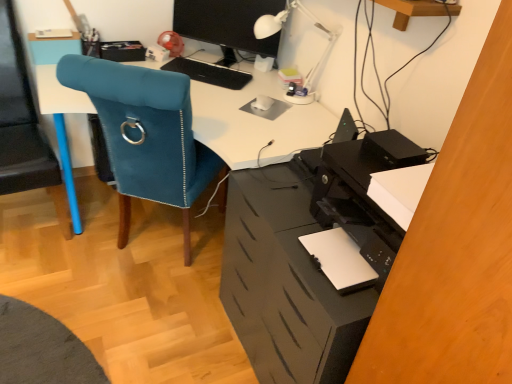
Question: Is black matte file cabinet at lower right at the back of velvet blue chair at left?

Choices:
 (A) yes
 (B) no

Answer: (B)

Question: Is velvet blue chair at left positioned far away from black matte file cabinet at lower right?

Choices:
 (A) no
 (B) yes

Answer: (A)

Question: Is velvet blue chair at left next to black matte file cabinet at lower right?

Choices:
 (A) no
 (B) yes

Answer: (A)

Question: Considering the relative sizes of velvet blue chair at left and black matte file cabinet at lower right in the image provided, is velvet blue chair at left taller than black matte file cabinet at lower right?

Choices:
 (A) yes
 (B) no

Answer: (A)

Question: Does velvet blue chair at left have a lesser width compared to black matte file cabinet at lower right?

Choices:
 (A) yes
 (B) no

Answer: (B)

Question: From a real-world perspective, does velvet blue chair at left sit lower than black matte file cabinet at lower right?

Choices:
 (A) no
 (B) yes

Answer: (A)

Question: Is white plastic table lamp at upper center further to camera compared to black matte keyboard at center?

Choices:
 (A) no
 (B) yes

Answer: (A)

Question: Does white plastic table lamp at upper center appear on the left side of black matte keyboard at center?

Choices:
 (A) yes
 (B) no

Answer: (B)

Question: Are white plastic table lamp at upper center and black matte keyboard at center far apart?

Choices:
 (A) no
 (B) yes

Answer: (A)

Question: Is white plastic table lamp at upper center facing towards black matte keyboard at center?

Choices:
 (A) no
 (B) yes

Answer: (A)

Question: Does white plastic table lamp at upper center have a lesser height compared to black matte keyboard at center?

Choices:
 (A) no
 (B) yes

Answer: (A)

Question: Is white plastic table lamp at upper center thinner than black matte keyboard at center?

Choices:
 (A) no
 (B) yes

Answer: (B)

Question: Considering the relative sizes of velvet blue chair at left and black matte keyboard at center in the image provided, is velvet blue chair at left wider than black matte keyboard at center?

Choices:
 (A) no
 (B) yes

Answer: (B)